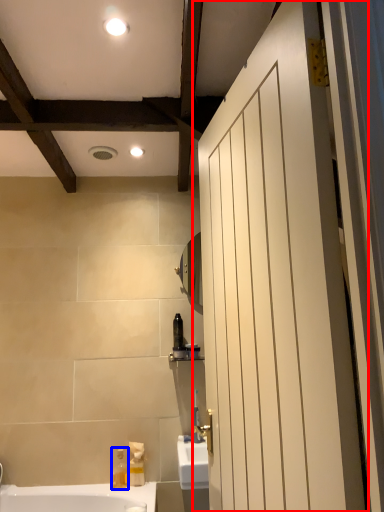
Question: Which point is closer to the camera, door (highlighted by a red box) or soap dispenser (highlighted by a blue box)?

Choices:
 (A) door
 (B) soap dispenser

Answer: (A)